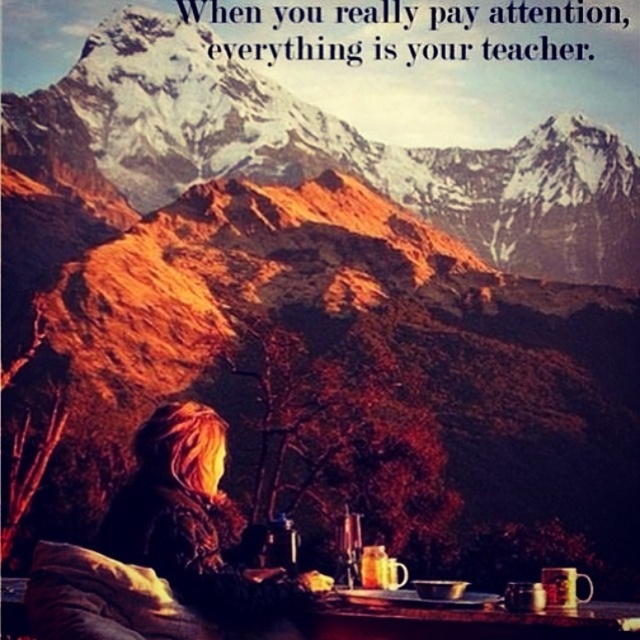
Based on the photo, who is shorter, snowy granite mountain at upper center or shiny brown jacket at lower left?

With less height is shiny brown jacket at lower left.

From the picture: Does snowy granite mountain at upper center have a larger size compared to shiny brown jacket at lower left?

Yes.

Is point (563, 24) more distant than point (204, 445)?

That is True.

At what (x,y) coordinates should I click in order to perform the action: click on snowy granite mountain at upper center. Please return your answer as a coordinate pair (x, y). The width and height of the screenshot is (640, 640). Looking at the image, I should click on (358, 109).

Does shiny brown jacket at lower left have a larger size compared to white paper at upper center?

No.

Between shiny brown jacket at lower left and white paper at upper center, which one has more height?

shiny brown jacket at lower left is taller.

Is point (212, 428) positioned behind point (259, 4)?

No, (212, 428) is closer to viewer.

This screenshot has width=640, height=640. I want to click on shiny brown jacket at lower left, so click(x=196, y=524).

Who is more distant from viewer, (x=550, y=109) or (x=339, y=58)?

The point (x=550, y=109) is behind.

Does snowy granite mountain at upper center have a smaller size compared to white paper at upper center?

No, snowy granite mountain at upper center is not smaller than white paper at upper center.

This screenshot has height=640, width=640. What are the coordinates of `snowy granite mountain at upper center` in the screenshot? It's located at (358, 109).

Identify the location of snowy granite mountain at upper center. The image size is (640, 640). (358, 109).